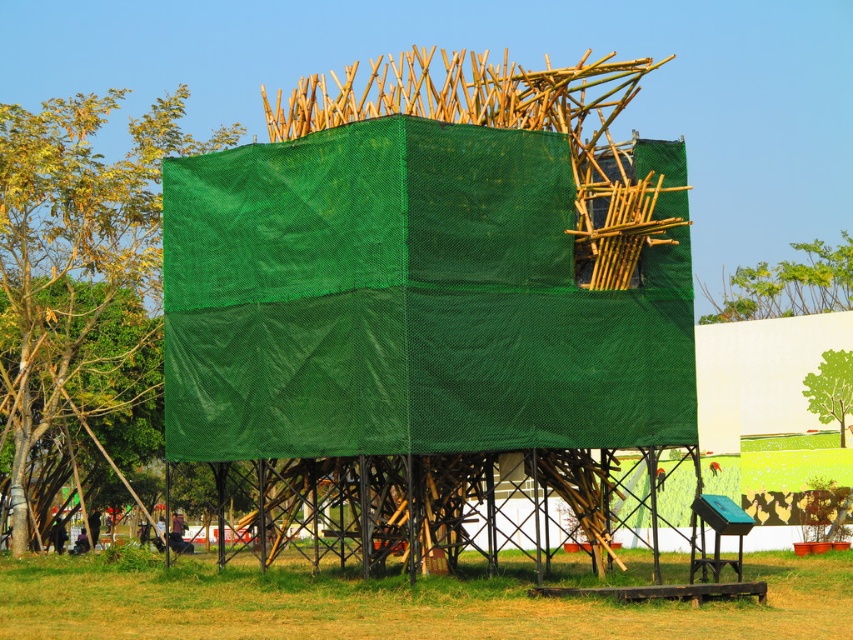
Question: Can you confirm if green mesh tree at upper left is positioned to the right of green leafy tree at upper right?

Choices:
 (A) no
 (B) yes

Answer: (A)

Question: Which point is closer to the camera taking this photo?

Choices:
 (A) (834, 412)
 (B) (131, 179)

Answer: (B)

Question: Does green mesh tree at upper left have a smaller size compared to green leafy tree at upper right?

Choices:
 (A) yes
 (B) no

Answer: (B)

Question: Which of the following is the closest to the observer?

Choices:
 (A) green mesh tree at upper left
 (B) green leafy tree at upper center
 (C) green leafy tree at upper right

Answer: (A)

Question: Can you confirm if green mesh tree at upper left is thinner than green leafy tree at upper right?

Choices:
 (A) no
 (B) yes

Answer: (A)

Question: Which point is closer to the camera?

Choices:
 (A) (86, 356)
 (B) (837, 371)

Answer: (A)